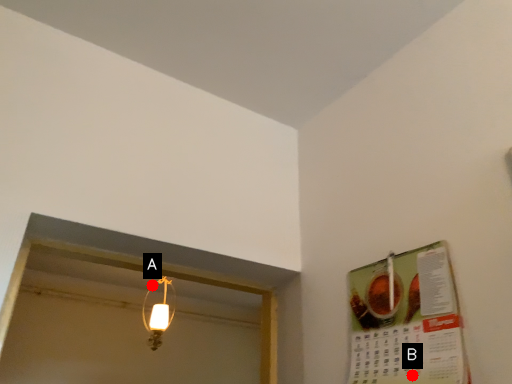
Question: Two points are circled on the image, labeled by A and B beside each circle. Among these points, which one is farthest from the camera?

Choices:
 (A) A is further
 (B) B is further

Answer: (A)